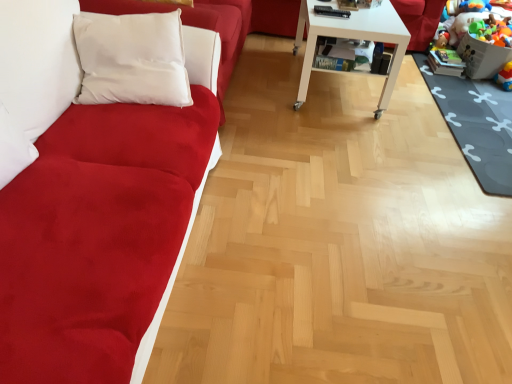
Question: Is plush multicolored toys at lower right, acting as the second toy starting from the bottom, to the left of rubberized plastic toy at lower right, which appears as the first toy when ordered from the bottom, from the viewer's perspective?

Choices:
 (A) no
 (B) yes

Answer: (B)

Question: Considering the relative sizes of plush multicolored toys at lower right, acting as the second toy starting from the bottom, and rubberized plastic toy at lower right, which appears as the first toy when ordered from the bottom, in the image provided, is plush multicolored toys at lower right, acting as the second toy starting from the bottom, bigger than rubberized plastic toy at lower right, which appears as the first toy when ordered from the bottom,?

Choices:
 (A) no
 (B) yes

Answer: (B)

Question: Is plush multicolored toys at lower right, acting as the second toy starting from the bottom, facing away from rubberized plastic toy at lower right, which is counted as the second toy, starting from the top?

Choices:
 (A) yes
 (B) no

Answer: (B)

Question: Is plush multicolored toys at lower right, acting as the 1th toy starting from the top, positioned before rubberized plastic toy at lower right, which appears as the first toy when ordered from the bottom?

Choices:
 (A) yes
 (B) no

Answer: (A)

Question: Is plush multicolored toys at lower right, acting as the 1th toy starting from the top, not inside rubberized plastic toy at lower right, which appears as the first toy when ordered from the bottom?

Choices:
 (A) yes
 (B) no

Answer: (A)

Question: From the image's perspective, is plush multicolored toys at lower right, acting as the second toy starting from the bottom, below rubberized plastic toy at lower right, which appears as the first toy when ordered from the bottom?

Choices:
 (A) yes
 (B) no

Answer: (B)

Question: Does plush multicolored toys at lower right, acting as the 1th toy starting from the top, have a greater height compared to suede-like red couch at left?

Choices:
 (A) yes
 (B) no

Answer: (B)

Question: Is suede-like red couch at left surrounded by plush multicolored toys at lower right, acting as the 1th toy starting from the top?

Choices:
 (A) no
 (B) yes

Answer: (A)

Question: Is plush multicolored toys at lower right, acting as the second toy starting from the bottom, wider than suede-like red couch at left?

Choices:
 (A) yes
 (B) no

Answer: (B)

Question: From the image's perspective, is plush multicolored toys at lower right, acting as the second toy starting from the bottom, located above suede-like red couch at left?

Choices:
 (A) yes
 (B) no

Answer: (A)

Question: Is the position of plush multicolored toys at lower right, acting as the 1th toy starting from the top, less distant than that of suede-like red couch at left?

Choices:
 (A) no
 (B) yes

Answer: (A)

Question: Can you confirm if plush multicolored toys at lower right, acting as the 1th toy starting from the top, is shorter than suede-like red couch at left?

Choices:
 (A) yes
 (B) no

Answer: (A)

Question: Is white glossy table at center positioned beyond the bounds of dark gray rubber mat at lower right?

Choices:
 (A) yes
 (B) no

Answer: (A)